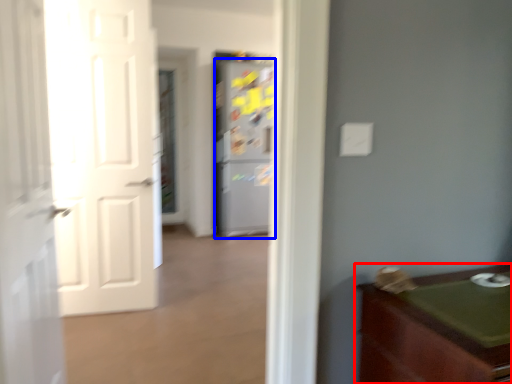
Question: Among these objects, which one is nearest to the camera, cabinetry (highlighted by a red box) or refrigerator (highlighted by a blue box)?

Choices:
 (A) cabinetry
 (B) refrigerator

Answer: (A)